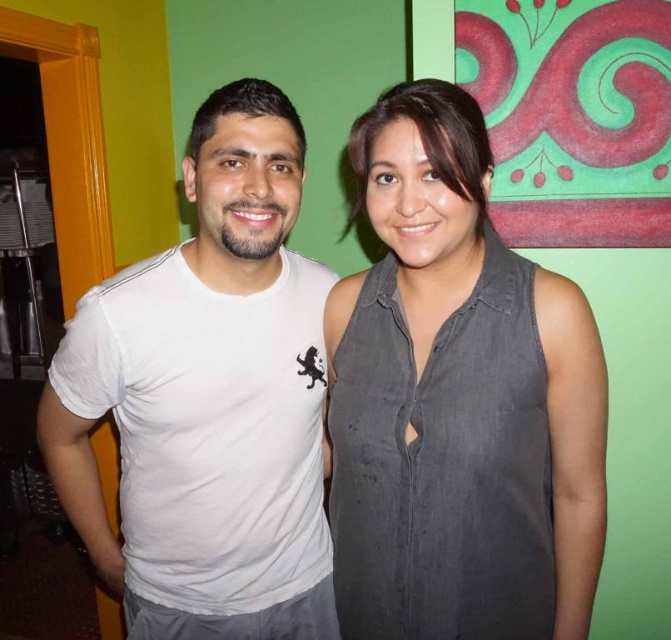
You are designing a virtual reality game where avatars need to interact with clothing items. You have an avatar facing the scene and wants to grab the gray cotton shirt at center. What coordinates should the avatar move to in order to reach it?

The gray cotton shirt at center is located at coordinates point (458, 401), so the avatar should move to those coordinates to reach it.